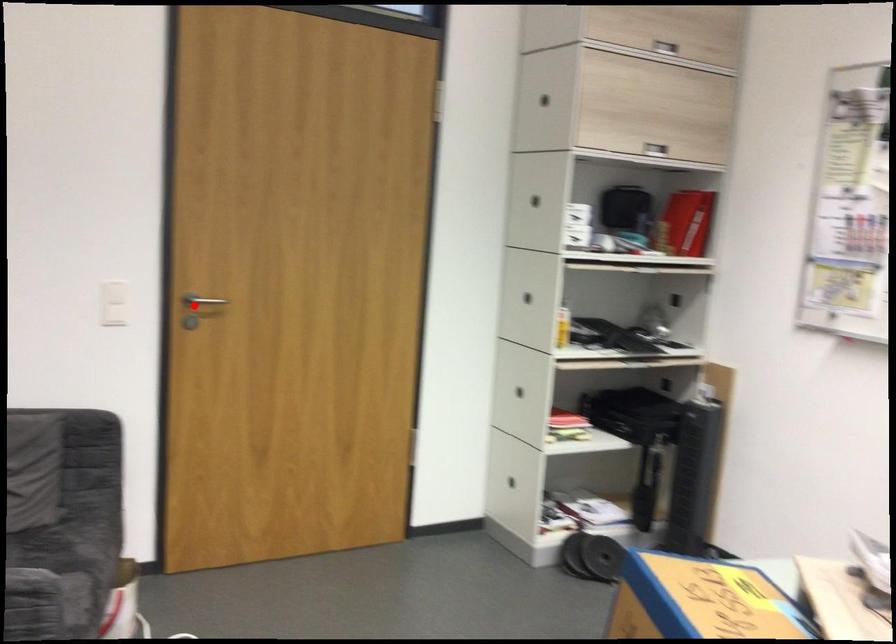
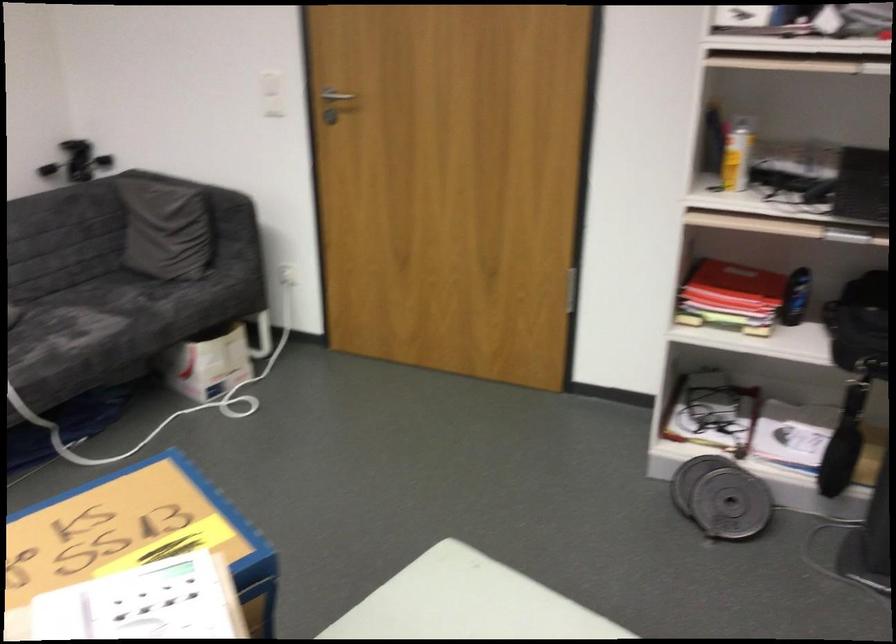
The point at the highlighted location is marked in the first image. Where is the corresponding point in the second image?

(331, 98)